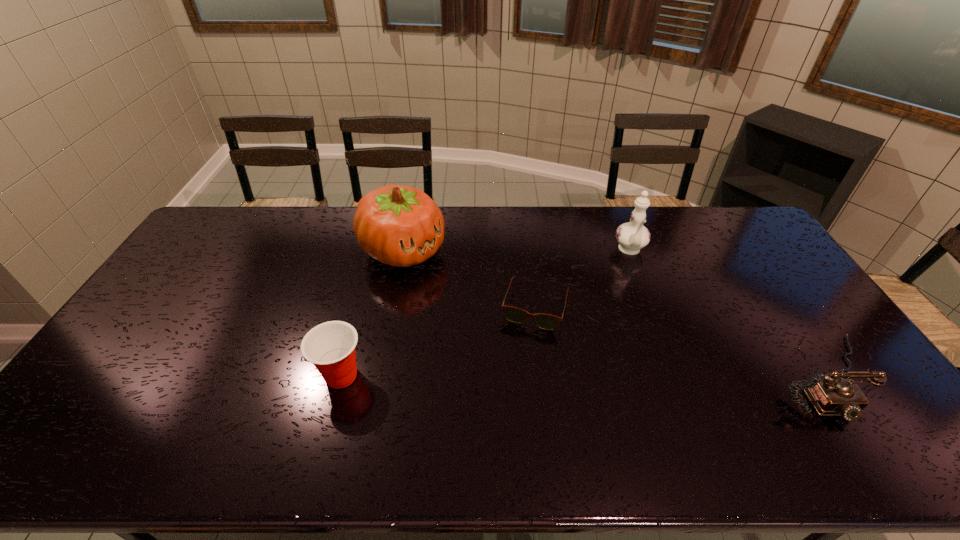
You are a GUI agent. You are given a task and a screenshot of the screen. Output one action in this format:
    pyautogui.click(x=<x>, y=<y>)
    Task: Click on the cup
    This screenshot has height=540, width=960.
    Given the screenshot: What is the action you would take?
    pyautogui.click(x=330, y=346)

At what (x,y) coordinates should I click in order to perform the action: click on the rightmost object. Please return your answer as a coordinate pair (x, y). Looking at the image, I should click on (830, 396).

Identify the location of spectacles. (545, 321).

Locate an element on the screen. the third farthest object is located at coordinates 545,321.

Image resolution: width=960 pixels, height=540 pixels. I want to click on chinaware, so click(632, 236).

Where is `pumpkin`? pumpkin is located at coordinates (400, 226).

Where is `vacant space situated 0.090m on the back of the cup`? vacant space situated 0.090m on the back of the cup is located at coordinates (353, 329).

Where is `vacant space positioned at the front view of the third nearest object`? vacant space positioned at the front view of the third nearest object is located at coordinates (503, 419).

You are a GUI agent. You are given a task and a screenshot of the screen. Output one action in this format:
    pyautogui.click(x=<x>, y=<y>)
    Task: Click on the vacant space located 0.170m at the front view of the third nearest object
    
    Given the screenshot: What is the action you would take?
    pyautogui.click(x=514, y=379)

The image size is (960, 540). What are the coordinates of `free space located at the front view of the third nearest object` in the screenshot? It's located at (x=519, y=361).